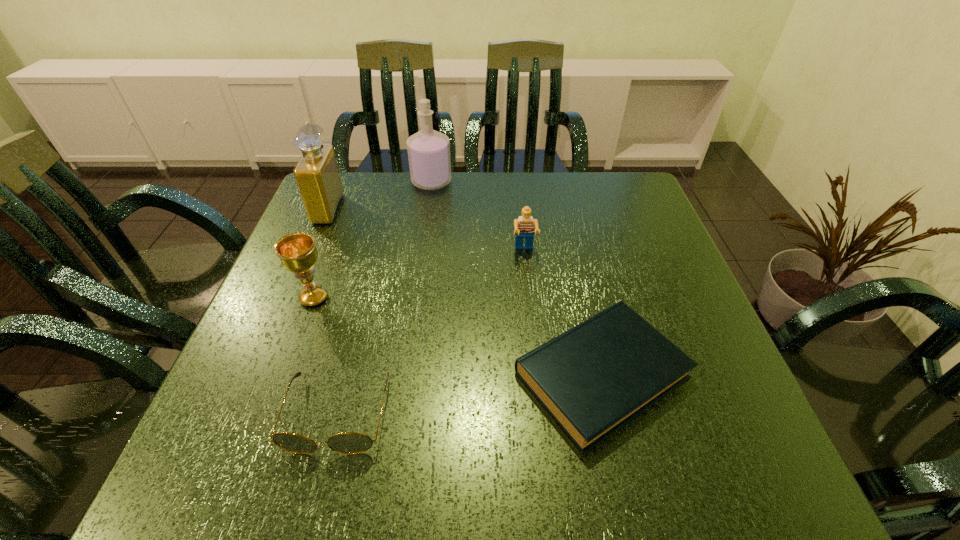
The width and height of the screenshot is (960, 540). Identify the location of object positioned at the right edge. (593, 379).

I want to click on object located in the far left corner section of the desktop, so click(317, 175).

Image resolution: width=960 pixels, height=540 pixels. In order to click on object that is at the near left corner in this screenshot , I will do `click(348, 442)`.

At what (x,y) coordinates should I click in order to perform the action: click on object positioned at the near right corner. Please return your answer as a coordinate pair (x, y). Looking at the image, I should click on (593, 379).

Where is `free space at the far edge of the desktop`? This screenshot has height=540, width=960. free space at the far edge of the desktop is located at coordinates (398, 197).

This screenshot has width=960, height=540. I want to click on free space at the near edge of the desktop, so click(319, 471).

At what (x,y) coordinates should I click in order to perform the action: click on vacant space at the left edge of the desktop. Please return your answer as a coordinate pair (x, y). This screenshot has width=960, height=540. Looking at the image, I should click on (242, 357).

Locate an element on the screen. This screenshot has width=960, height=540. free space at the right edge of the desktop is located at coordinates (712, 359).

You are a GUI agent. You are given a task and a screenshot of the screen. Output one action in this format:
    pyautogui.click(x=<x>, y=<y>)
    Task: Click on the vacant space at the far left corner of the desktop
    The width and height of the screenshot is (960, 540).
    Given the screenshot: What is the action you would take?
    pyautogui.click(x=355, y=199)

Where is `vacant space at the far right corner of the desktop`? vacant space at the far right corner of the desktop is located at coordinates (619, 186).